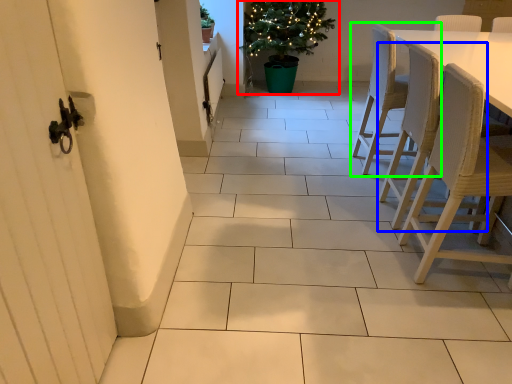
Question: Estimate the real-world distances between objects in this image. Which object is closer to houseplant (highlighted by a red box), chair (highlighted by a blue box) or chair (highlighted by a green box)?

Choices:
 (A) chair
 (B) chair

Answer: (B)